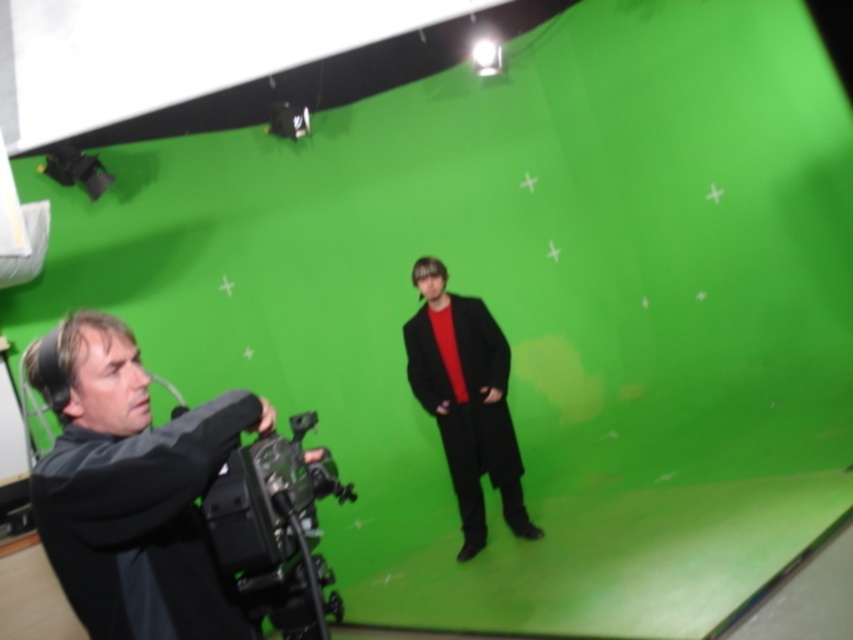
You are setting up a camera in the studio and need to place the dark gray fabric camera at lower left. According to the studio layout, where should you position it?

The dark gray fabric camera at lower left should be positioned at point 0.764 on the x axis and 0.155 on the y axis.